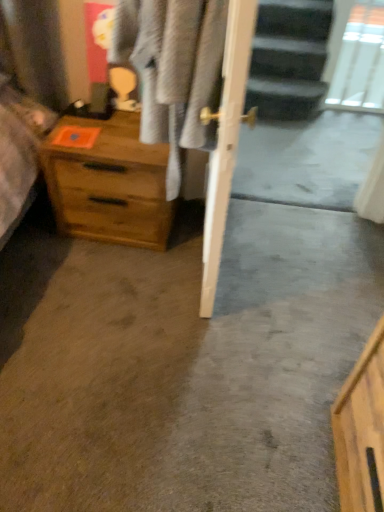
Where is `light gray fabric at center`? This screenshot has height=512, width=384. light gray fabric at center is located at coordinates (172, 69).

Image resolution: width=384 pixels, height=512 pixels. Identify the location of transparent glass door at upper right. (359, 60).

At what (x,y) coordinates should I click in order to perform the action: click on light gray fabric at center. Please return your answer as a coordinate pair (x, y). The image size is (384, 512). Looking at the image, I should click on (172, 69).

Is transparent glass door at upper right at the back of light gray fabric at center?

No, light gray fabric at center's orientation is not away from transparent glass door at upper right.

Is light gray fabric at center not within transparent glass door at upper right?

Yes, light gray fabric at center is outside of transparent glass door at upper right.

Which of these two, light gray fabric at center or transparent glass door at upper right, is smaller?

Smaller between the two is transparent glass door at upper right.

Are light gray fabric at center and transparent glass door at upper right located far from each other?

Indeed, light gray fabric at center is not near transparent glass door at upper right.

Consider the image. Between wooden chest of drawers at left and transparent glass door at upper right, which one is positioned behind?

transparent glass door at upper right.

This screenshot has width=384, height=512. In order to click on glass door above the wooden chest of drawers at left (from a real-world perspective) in this screenshot , I will do `click(359, 60)`.

Considering the sizes of wooden chest of drawers at left and transparent glass door at upper right in the image, is wooden chest of drawers at left taller or shorter than transparent glass door at upper right?

Clearly, wooden chest of drawers at left is shorter compared to transparent glass door at upper right.

Is wooden chest of drawers at left with transparent glass door at upper right?

They are not placed beside each other.

Looking at this image, is transparent glass door at upper right to the right of wooden chest of drawers at left from the viewer's perspective?

Indeed, transparent glass door at upper right is positioned on the right side of wooden chest of drawers at left.

Does transparent glass door at upper right have a larger size compared to wooden chest of drawers at left?

Actually, transparent glass door at upper right might be smaller than wooden chest of drawers at left.

From the image's perspective, is transparent glass door at upper right below wooden chest of drawers at left?

No, from the image's perspective, transparent glass door at upper right is not below wooden chest of drawers at left.

Does transparent glass door at upper right touch wooden chest of drawers at left?

No, transparent glass door at upper right is not in contact with wooden chest of drawers at left.

Would you say light gray fabric at center is inside or outside wooden chest of drawers at left?

light gray fabric at center is located beyond the bounds of wooden chest of drawers at left.

From a real-world perspective, which object rests below the other?

In real-world perspective, wooden chest of drawers at left is lower.

Which of these two, light gray fabric at center or wooden chest of drawers at left, is smaller?

wooden chest of drawers at left is smaller.

You are a GUI agent. You are given a task and a screenshot of the screen. Output one action in this format:
    pyautogui.click(x=<x>, y=<y>)
    Task: Click on the chest of drawers located below the light gray fabric at center (from the image's perspective)
    Image resolution: width=384 pixels, height=512 pixels.
    Given the screenshot: What is the action you would take?
    pyautogui.click(x=109, y=184)

Between wooden chest of drawers at left and light gray fabric at center, which one is positioned in front?

light gray fabric at center is more forward.

From the image's perspective, between wooden chest of drawers at left and light gray fabric at center, which one is located above?

From the image's view, light gray fabric at center is above.

Is point (86, 149) closer to viewer compared to point (162, 89)?

No, it is not.

Looking at the image, does transparent glass door at upper right seem bigger or smaller compared to light gray fabric at center?

transparent glass door at upper right is smaller than light gray fabric at center.

Looking at this image, considering the relative sizes of transparent glass door at upper right and light gray fabric at center in the image provided, is transparent glass door at upper right taller than light gray fabric at center?

Incorrect, the height of transparent glass door at upper right is not larger of that of light gray fabric at center.

From the image's perspective, which is above, transparent glass door at upper right or light gray fabric at center?

From the image's view, transparent glass door at upper right is above.

I want to click on clothing lying on the left of transparent glass door at upper right, so click(x=172, y=69).

Locate an element on the screen. glass door on the right of light gray fabric at center is located at coordinates (359, 60).

Identify the location of the chest of drawers lying in front of the transparent glass door at upper right. The height and width of the screenshot is (512, 384). (109, 184).

Estimate the real-world distances between objects in this image. Which object is closer to wooden chest of drawers at left, light gray fabric at center or transparent glass door at upper right?

Among the two, light gray fabric at center is located nearer to wooden chest of drawers at left.

Estimate the real-world distances between objects in this image. Which object is further from transparent glass door at upper right, wooden chest of drawers at left or light gray fabric at center?

Among the two, light gray fabric at center is located further to transparent glass door at upper right.

Estimate the real-world distances between objects in this image. Which object is further from transparent glass door at upper right, light gray fabric at center or wooden chest of drawers at left?

light gray fabric at center.

When comparing their distances from light gray fabric at center, does transparent glass door at upper right or wooden chest of drawers at left seem further?

Based on the image, transparent glass door at upper right appears to be further to light gray fabric at center.

When comparing their distances from light gray fabric at center, does wooden chest of drawers at left or transparent glass door at upper right seem further?

transparent glass door at upper right lies further to light gray fabric at center than the other object.

Considering their positions, is transparent glass door at upper right positioned closer to wooden chest of drawers at left than light gray fabric at center?

light gray fabric at center is positioned closer to the anchor wooden chest of drawers at left.

Identify the location of clothing situated between wooden chest of drawers at left and transparent glass door at upper right from left to right. (172, 69).